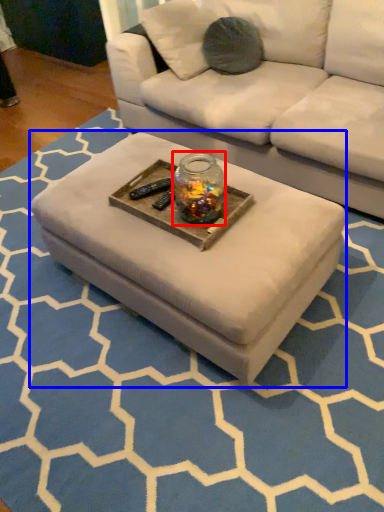
Question: Which object is closer to the camera taking this photo, glass jar (highlighted by a red box) or coffee table (highlighted by a blue box)?

Choices:
 (A) glass jar
 (B) coffee table

Answer: (B)